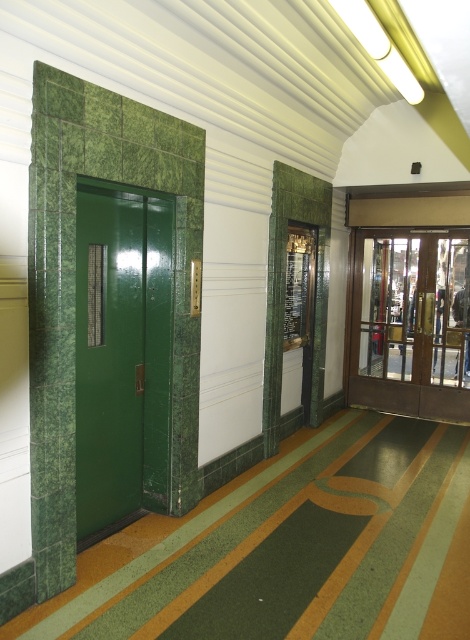
Question: Which of the following is the closest to the observer?

Choices:
 (A) green glossy elevator at left
 (B) green polished wood elevator at center

Answer: (A)

Question: Among these points, which one is farthest from the camera?

Choices:
 (A) (444, 289)
 (B) (146, 275)

Answer: (A)

Question: Where is green glossy elevator at left located in relation to green polished wood elevator at center in the image?

Choices:
 (A) left
 (B) right

Answer: (A)

Question: Which point is closer to the camera?

Choices:
 (A) green polished wood elevator at center
 (B) green glossy elevator at left

Answer: (B)

Question: Does green glossy elevator at left appear on the right side of green polished wood elevator at center?

Choices:
 (A) yes
 (B) no

Answer: (B)

Question: Can you confirm if green glossy elevator at left is thinner than green polished wood elevator at center?

Choices:
 (A) no
 (B) yes

Answer: (B)